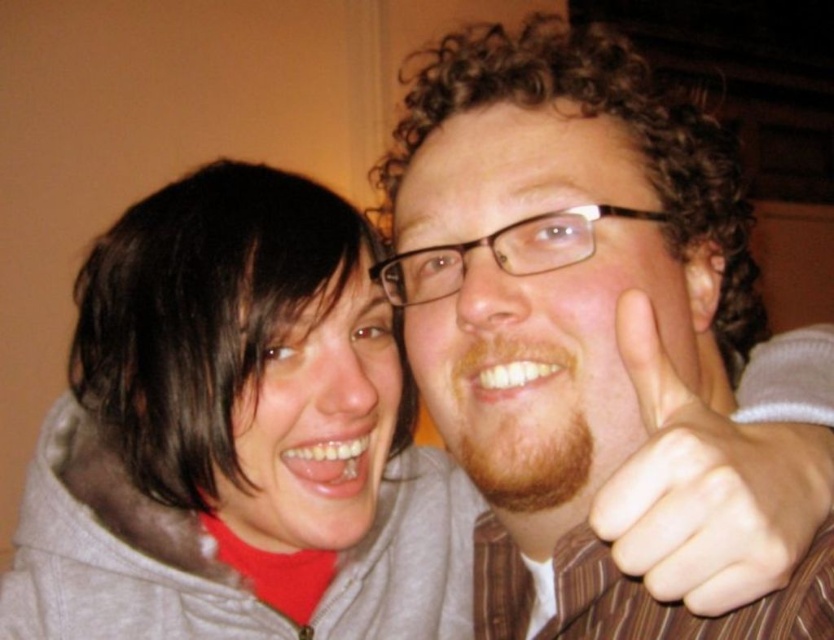
You are a photographer trying to focus on the matte gray hoodie at center. What are the coordinates where you should aim your camera?

The coordinates for the matte gray hoodie at center are at point (237,436).

You are standing in front of the image and want to know how far the point at coordinates (254, 451) is from you. Can you determine the distance?

The point at coordinates (254, 451) is 25.43 inches away from the viewer.